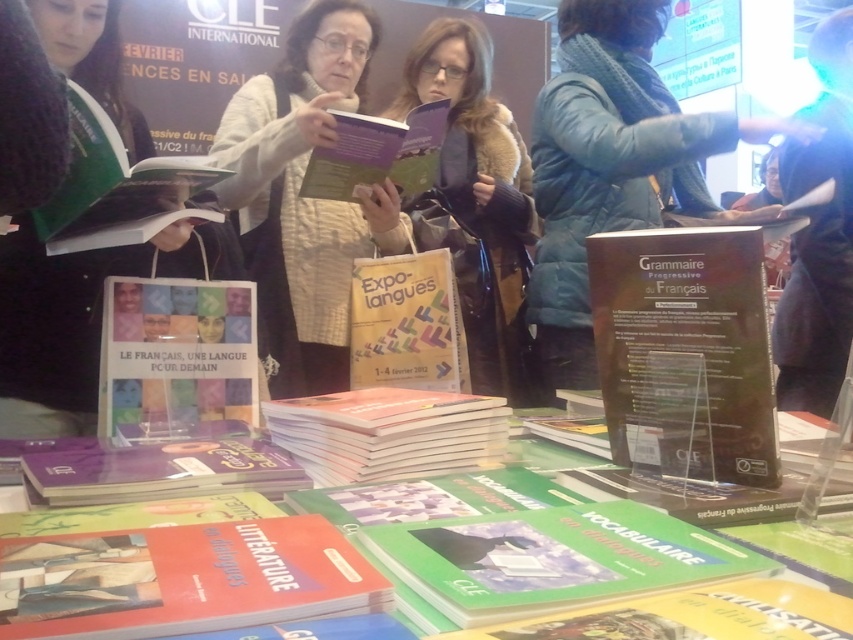
You are an event organizer at the French language fair and need to place a new display stand behind the brown fur coat at center and orange matte book at center. Since the stand will block the view of one of them, which item will remain visible to visitors?

The brown fur coat at center will remain visible because it is much taller than the orange matte book at center, so the stand will block the shorter orange matte book at center but not the taller brown fur coat at center.